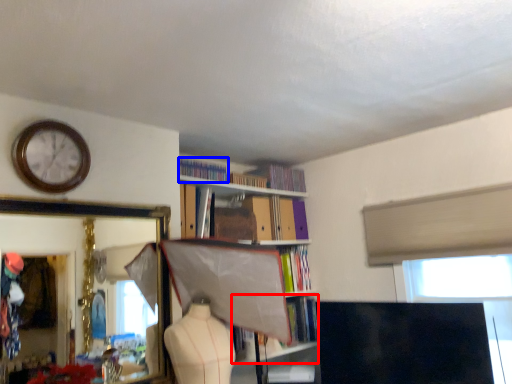
Question: Among these objects, which one is farthest to the camera, book (highlighted by a red box) or book (highlighted by a blue box)?

Choices:
 (A) book
 (B) book

Answer: (A)